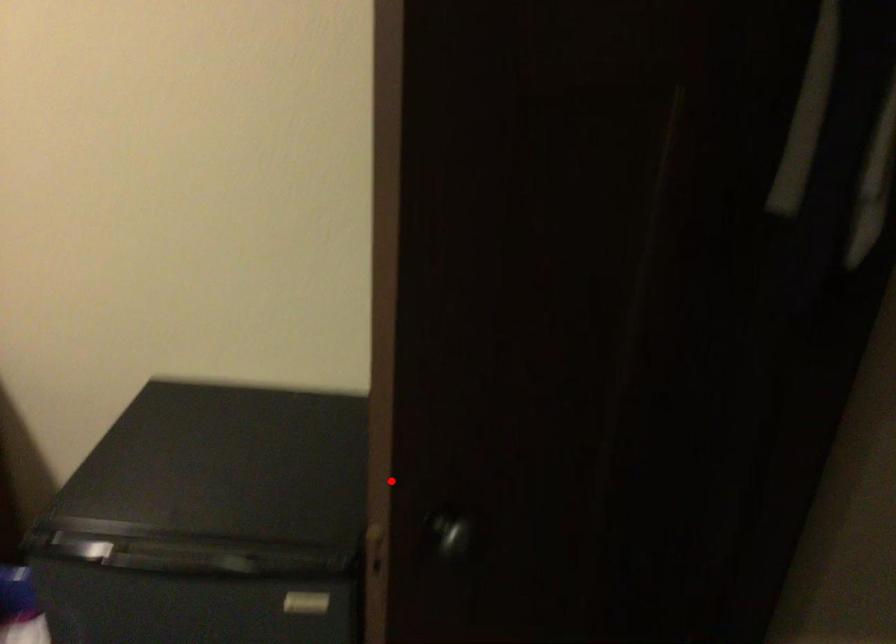
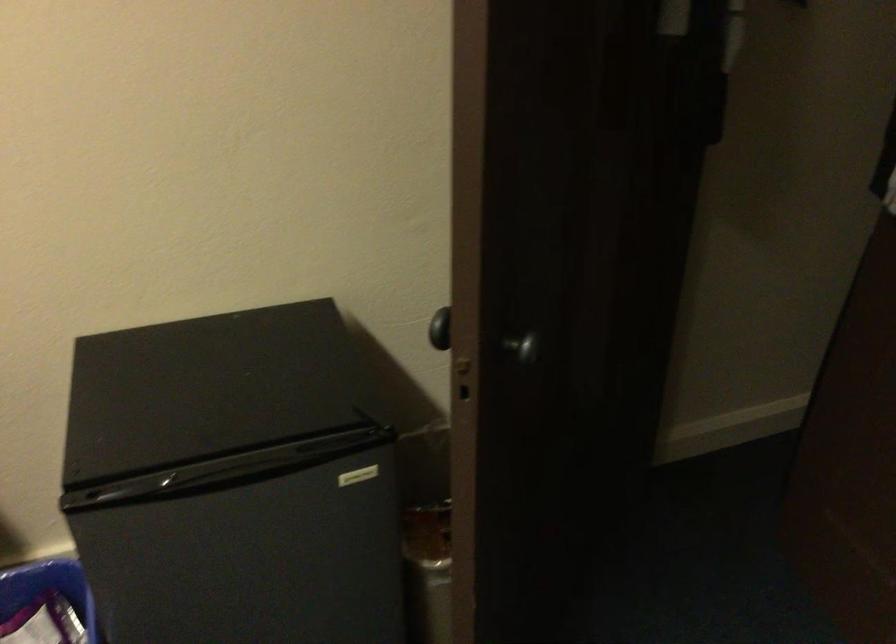
The point at the highlighted location is marked in the first image. Where is the corresponding point in the second image?

(440, 328)